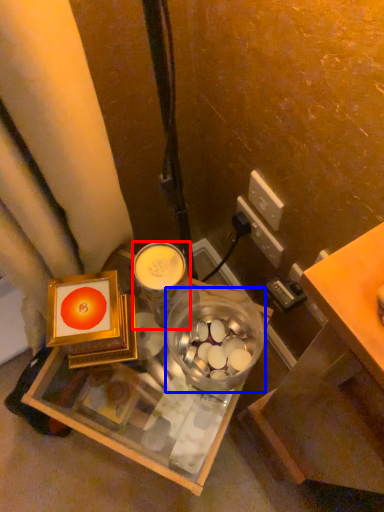
Question: Which object appears closest to the camera in this image, coffee cup (highlighted by a red box) or glass bowl (highlighted by a blue box)?

Choices:
 (A) coffee cup
 (B) glass bowl

Answer: (B)